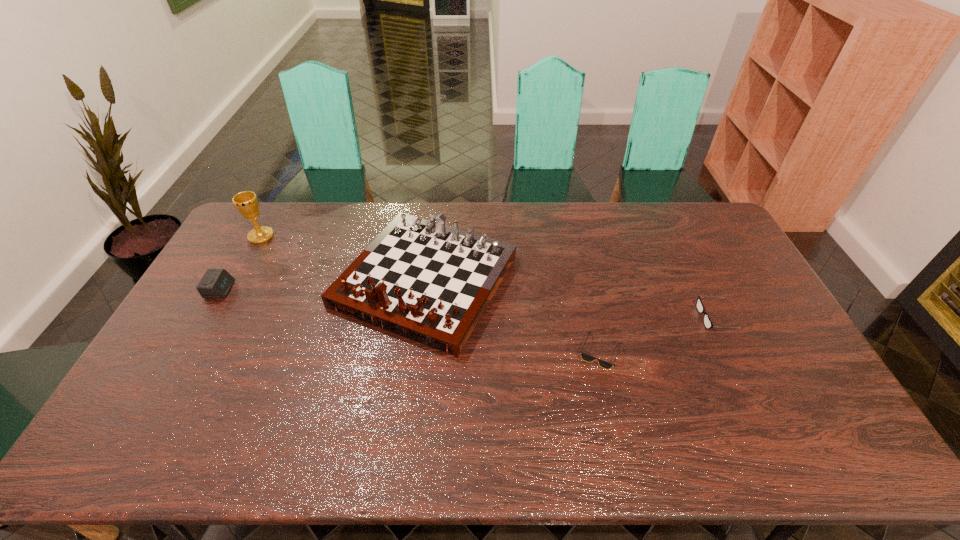
The image size is (960, 540). In order to click on vacant space located 0.090m on the front-facing side of the rightmost object in this screenshot , I will do `click(671, 318)`.

Image resolution: width=960 pixels, height=540 pixels. In order to click on free space located 0.220m on the front-facing side of the rightmost object in this screenshot , I will do `click(629, 318)`.

Where is `free region located 0.160m on the front-facing side of the rightmost object`? free region located 0.160m on the front-facing side of the rightmost object is located at coordinates coord(648,318).

Locate an element on the screen. The height and width of the screenshot is (540, 960). free point located on the lenses of the sunglasses is located at coordinates (610, 392).

Locate an element on the screen. The width and height of the screenshot is (960, 540). chalice positioned at the far edge is located at coordinates (246, 202).

Where is `gameboard present at the far edge`? The width and height of the screenshot is (960, 540). gameboard present at the far edge is located at coordinates (420, 279).

You are a GUI agent. You are given a task and a screenshot of the screen. Output one action in this format:
    pyautogui.click(x=<x>, y=<y>)
    Task: Click on the chalice that is positioned at the left edge
    This screenshot has height=540, width=960.
    Given the screenshot: What is the action you would take?
    pyautogui.click(x=246, y=202)

At what (x,y) coordinates should I click in order to perform the action: click on alarm clock at the left edge. Please return your answer as a coordinate pair (x, y). This screenshot has width=960, height=540. Looking at the image, I should click on (216, 283).

What are the coordinates of `object located in the right edge section of the desktop` in the screenshot? It's located at (708, 324).

The image size is (960, 540). Find the location of `object positioned at the far left corner`. object positioned at the far left corner is located at coordinates (246, 202).